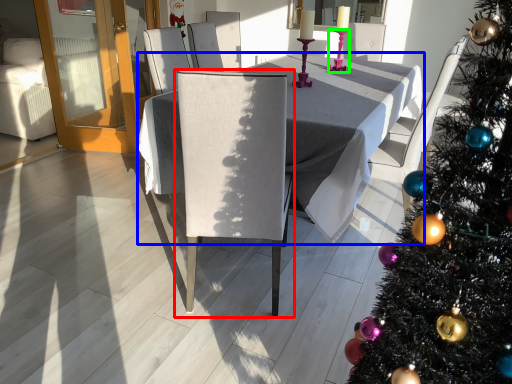
Question: Considering the real-world distances, which object is farthest from chair (highlighted by a red box)? table (highlighted by a blue box) or candle holder (highlighted by a green box)?

Choices:
 (A) table
 (B) candle holder

Answer: (B)